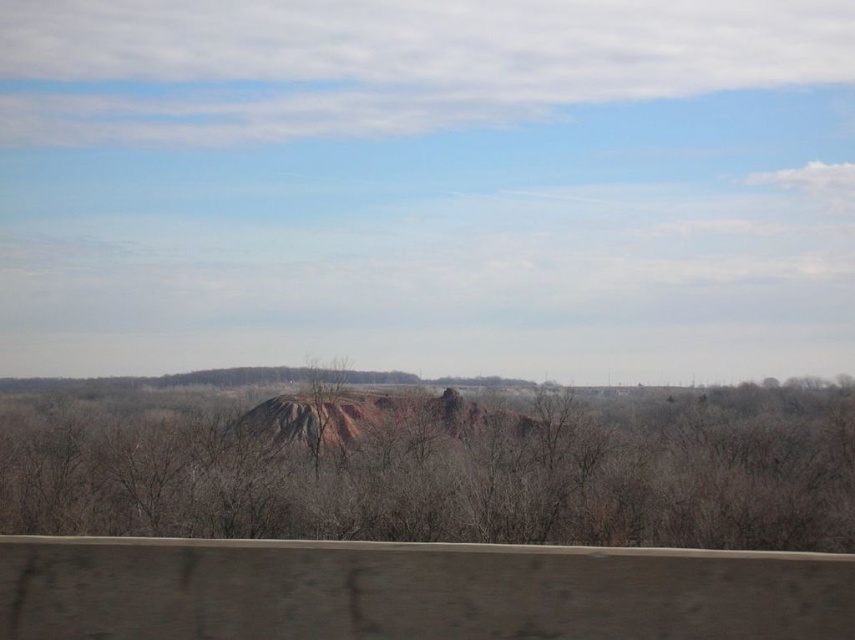
You are a GUI agent. You are given a task and a screenshot of the screen. Output one action in this format:
    pyautogui.click(x=<x>, y=<y>)
    Task: Click on the brown matte tree at center
    This screenshot has width=855, height=640.
    Given the screenshot: What is the action you would take?
    pyautogui.click(x=434, y=464)

Which is above, brown matte tree at center or rustic clay mountain at center?

rustic clay mountain at center is higher up.

What do you see at coordinates (434, 464) in the screenshot? This screenshot has width=855, height=640. I see `brown matte tree at center` at bounding box center [434, 464].

Identify the location of brown matte tree at center. This screenshot has height=640, width=855. (434, 464).